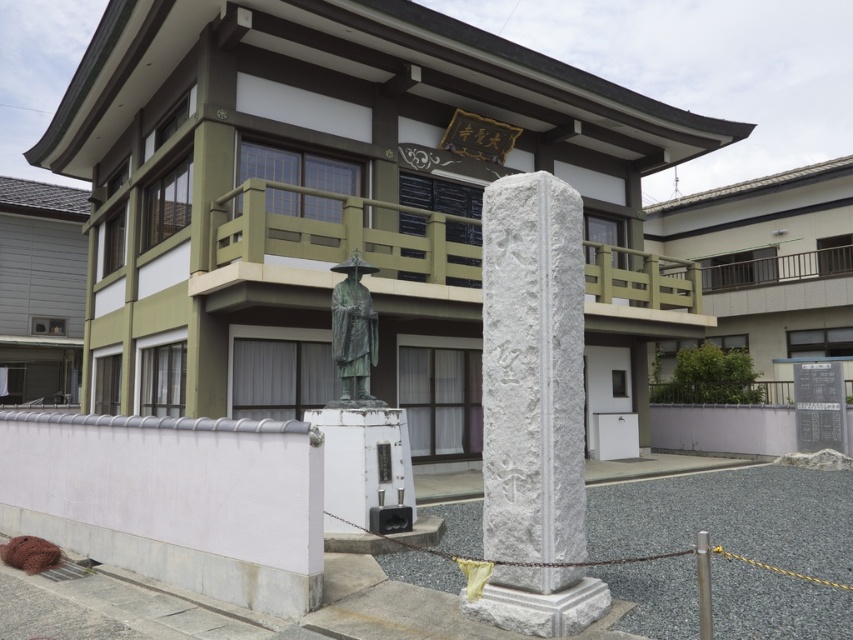
Does white stone pillar at center have a lesser width compared to bronze statue at center?

No, white stone pillar at center is not thinner than bronze statue at center.

Measure the distance between white stone pillar at center and bronze statue at center.

The distance of white stone pillar at center from bronze statue at center is 2.66 meters.

Is point (531, 426) positioned before point (373, 333)?

Yes, point (531, 426) is closer to viewer.

Locate an element on the screen. The height and width of the screenshot is (640, 853). white stone pillar at center is located at coordinates (532, 371).